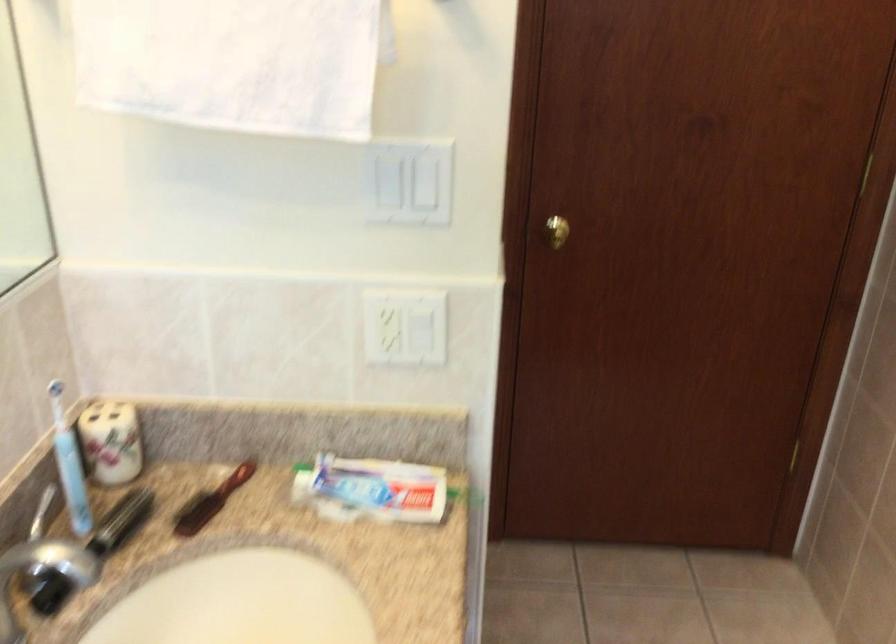
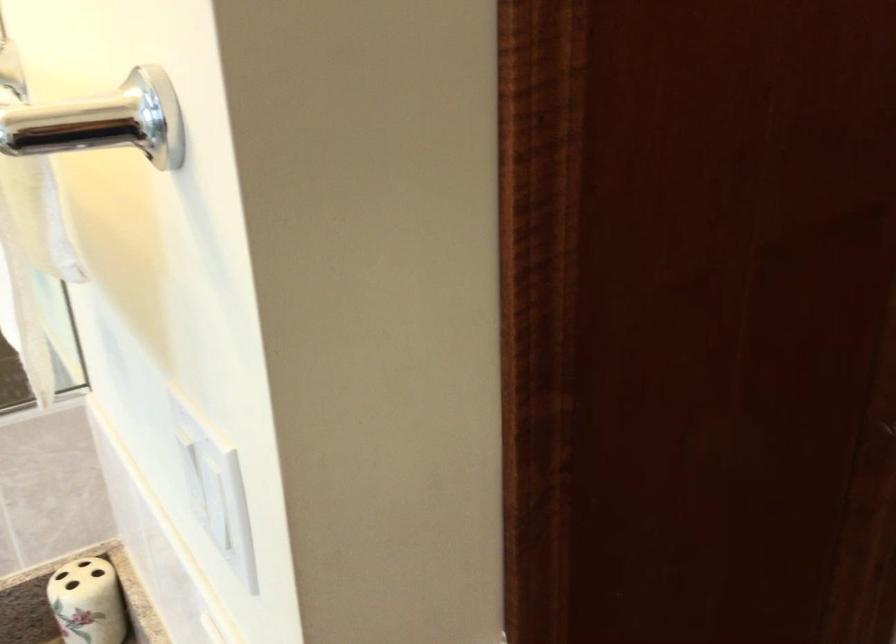
Find the pixel in the second image that matches (124,422) in the first image.

(88, 601)